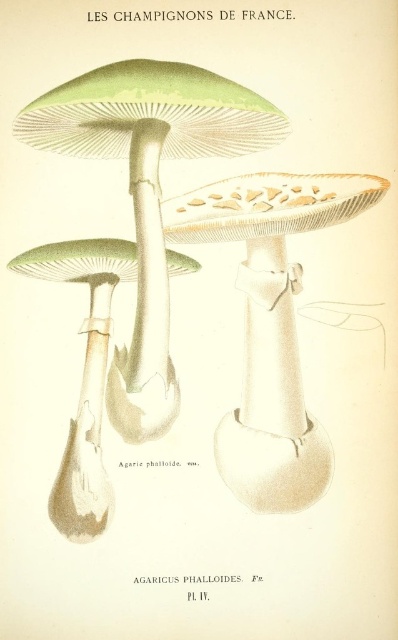
Is smooth beige mushroom at center to the right of green matte mushroom at center from the viewer's perspective?

Yes, smooth beige mushroom at center is to the right of green matte mushroom at center.

Which of these two, smooth beige mushroom at center or green matte mushroom at center, stands taller?

smooth beige mushroom at center is taller.

What do you see at coordinates (271, 323) in the screenshot?
I see `smooth beige mushroom at center` at bounding box center [271, 323].

This screenshot has height=640, width=398. Find the location of `smooth beige mushroom at center`. smooth beige mushroom at center is located at coordinates (271, 323).

Which is in front, point (150, 433) or point (296, 413)?

Point (150, 433) is in front.

Can you confirm if green matte agaricus phalloides at center is positioned below smooth beige mushroom at center?

Actually, green matte agaricus phalloides at center is above smooth beige mushroom at center.

Which is in front, point (148, 278) or point (234, 212)?

Point (234, 212) is more forward.

Find the location of `green matte agaricus phalloides at center`. green matte agaricus phalloides at center is located at coordinates click(148, 189).

Between green matte agaricus phalloides at center and green matte mushroom at center, which one is positioned higher?

green matte agaricus phalloides at center is higher up.

Does green matte agaricus phalloides at center have a smaller size compared to green matte mushroom at center?

Actually, green matte agaricus phalloides at center might be larger than green matte mushroom at center.

Is point (136, 388) positioned in front of point (68, 484)?

That is False.

You are a GUI agent. You are given a task and a screenshot of the screen. Output one action in this format:
    pyautogui.click(x=<x>, y=<y>)
    Task: Click on the green matte agaricus phalloides at center
    This screenshot has width=398, height=640.
    Given the screenshot: What is the action you would take?
    pyautogui.click(x=148, y=189)